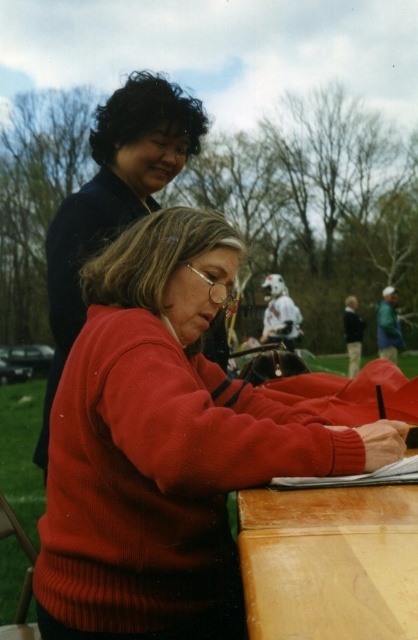
You are standing in the park and see the woman in the red sweater at center. Where exactly is the red sweater located in relation to the point marked at coordinates (165, 444)?

The point marked at coordinates (165, 444) is exactly where the knitted red sweater at center is located.